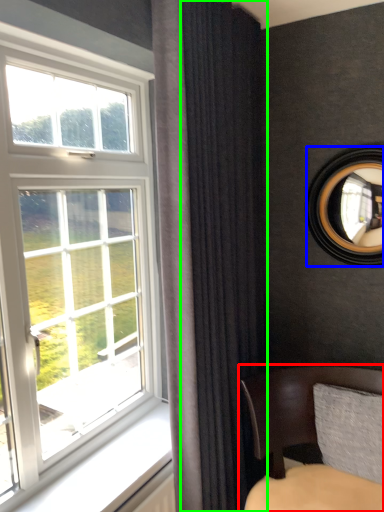
Question: Which is farther away from chair (highlighted by a red box)? mirror (highlighted by a blue box) or curtain (highlighted by a green box)?

Choices:
 (A) mirror
 (B) curtain

Answer: (A)